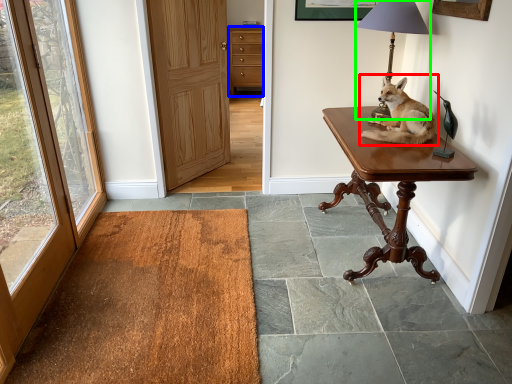
Question: Considering the real-world distances, which object is closest to dog (highlighted by a red box)? cabinetry (highlighted by a blue box) or lamp (highlighted by a green box).

Choices:
 (A) cabinetry
 (B) lamp

Answer: (B)